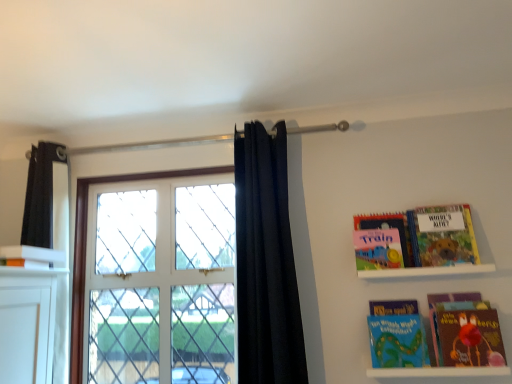
Question: Is white glass window at center in contact with matte pink book at upper right, placed as the 2th book when sorted from left to right?

Choices:
 (A) yes
 (B) no

Answer: (B)

Question: Is white glass window at center at the left side of matte pink book at upper right, the third book in the right-to-left sequence?

Choices:
 (A) no
 (B) yes

Answer: (B)

Question: Is there a large distance between white glass window at center and matte pink book at upper right, the third book in the right-to-left sequence?

Choices:
 (A) yes
 (B) no

Answer: (B)

Question: Could you tell me if white glass window at center is facing matte pink book at upper right, placed as the 2th book when sorted from left to right?

Choices:
 (A) yes
 (B) no

Answer: (B)

Question: Does white glass window at center appear on the right side of matte pink book at upper right, placed as the 2th book when sorted from left to right?

Choices:
 (A) yes
 (B) no

Answer: (B)

Question: From a real-world perspective, is white glossy book at upper left, which ranks as the 4th book in right-to-left order, above or below matte red book at lower right?

Choices:
 (A) below
 (B) above

Answer: (B)

Question: Is white glossy book at upper left, which appears as the 1th book when viewed from the left, to the left or to the right of matte red book at lower right in the image?

Choices:
 (A) left
 (B) right

Answer: (A)

Question: Is white glossy book at upper left, which ranks as the 4th book in right-to-left order, situated inside matte red book at lower right or outside?

Choices:
 (A) inside
 (B) outside

Answer: (B)

Question: From the image's perspective, relative to matte red book at lower right, is white glossy book at upper left, which appears as the 1th book when viewed from the left, above or below?

Choices:
 (A) above
 (B) below

Answer: (A)

Question: Considering the positions of white glossy book at upper left, which appears as the 1th book when viewed from the left, and black fabric curtain at center in the image, is white glossy book at upper left, which appears as the 1th book when viewed from the left, bigger or smaller than black fabric curtain at center?

Choices:
 (A) big
 (B) small

Answer: (B)

Question: Considering the positions of white glossy book at upper left, which ranks as the 4th book in right-to-left order, and black fabric curtain at center in the image, is white glossy book at upper left, which ranks as the 4th book in right-to-left order, taller or shorter than black fabric curtain at center?

Choices:
 (A) short
 (B) tall

Answer: (A)

Question: Is white glossy book at upper left, which appears as the 1th book when viewed from the left, situated inside black fabric curtain at center or outside?

Choices:
 (A) inside
 (B) outside

Answer: (B)

Question: Relative to black fabric curtain at center, is white glossy book at upper left, which appears as the 1th book when viewed from the left, in front or behind?

Choices:
 (A) behind
 (B) front

Answer: (A)

Question: In the image, is matte pink book at upper right, placed as the 2th book when sorted from left to right, positioned in front of or behind hardcover book at upper right, which is the 1th book from right to left?

Choices:
 (A) front
 (B) behind

Answer: (B)

Question: Which is correct: matte pink book at upper right, placed as the 2th book when sorted from left to right, is inside hardcover book at upper right, which is the 1th book from right to left, or outside of it?

Choices:
 (A) outside
 (B) inside

Answer: (A)